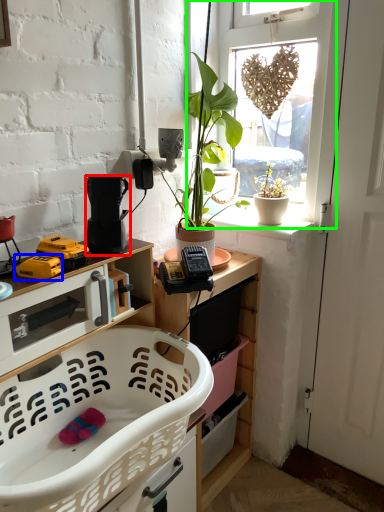
Question: Which object is positioned farthest from appliance (highlighted by a red box)? Select from toy (highlighted by a blue box) and window (highlighted by a green box).

Choices:
 (A) toy
 (B) window

Answer: (B)